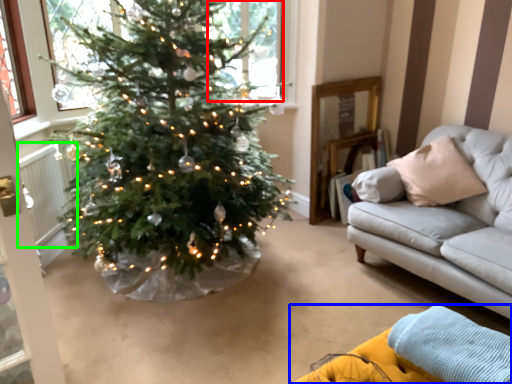
Question: Which object is the farthest from window (highlighted by a red box)? Choose among these: couch (highlighted by a blue box) or radiator (highlighted by a green box).

Choices:
 (A) couch
 (B) radiator

Answer: (A)